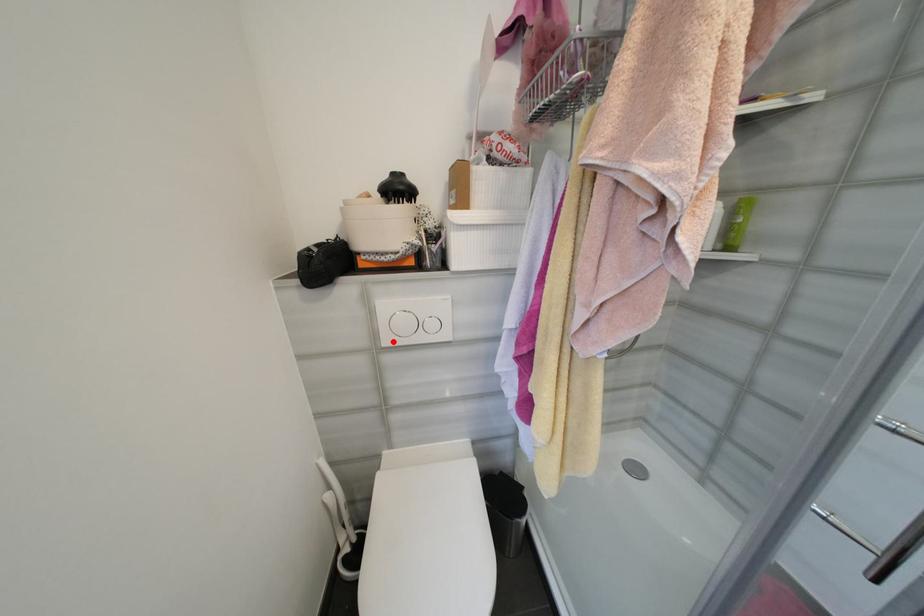
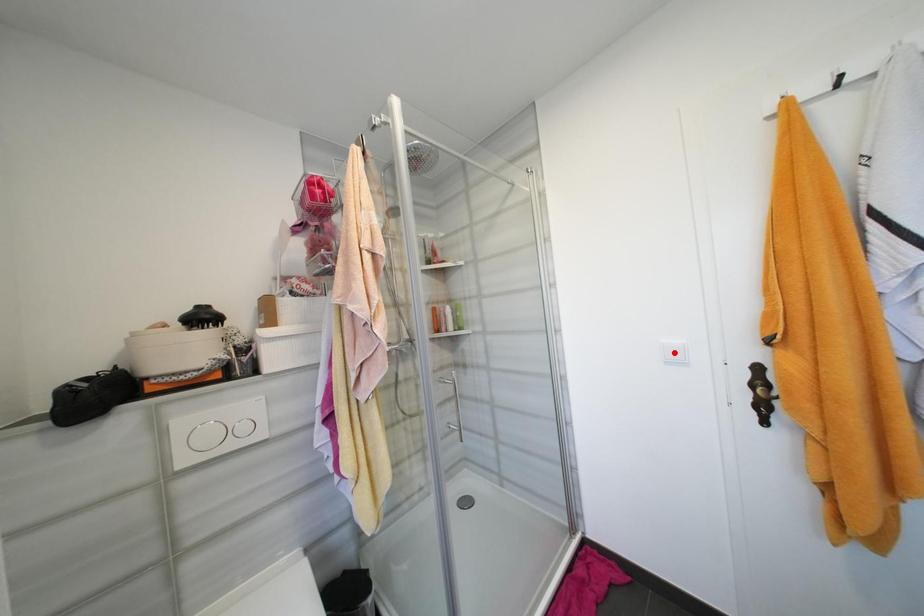
I am providing you with two images of the same scene from different viewpoints. A red point is marked on the first image and another point is marked on the second image. Is the marked point in image1 the same physical position as the marked point in image2?

No